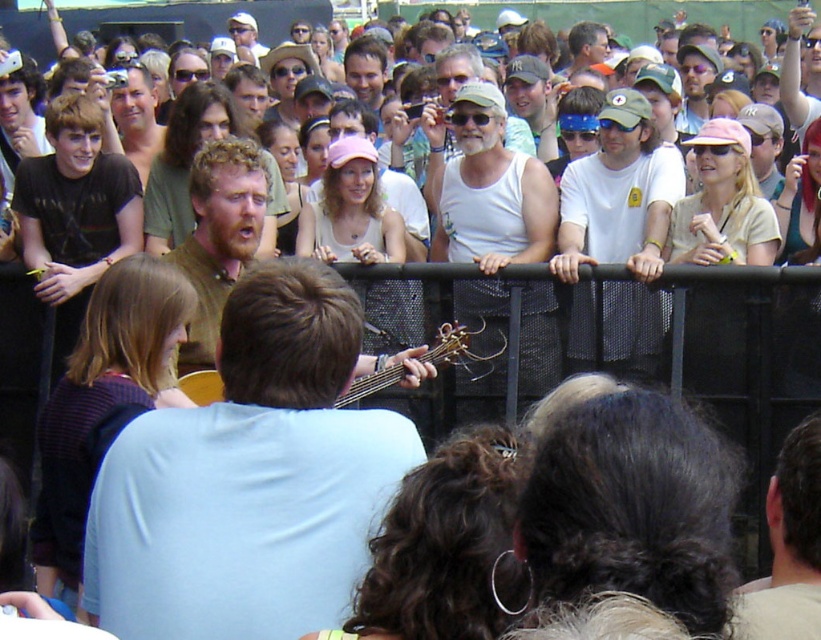
Question: Is white tank top at center wider than brown hair at center?

Choices:
 (A) yes
 (B) no

Answer: (A)

Question: Does white tank top at center appear over matte white tank top at center?

Choices:
 (A) no
 (B) yes

Answer: (A)

Question: Which object appears farthest from the camera in this image?

Choices:
 (A) brown wood guitar at center
 (B) brown hair at center

Answer: (B)

Question: Considering the real-world distances, which object is closest to the matte brown shirt at center?

Choices:
 (A) brown wood guitar at center
 (B) brown hair at center
 (C) pink fabric cap at upper right

Answer: (B)

Question: Which object is farther from the camera taking this photo?

Choices:
 (A) dark brown hair at upper center
 (B) white cotton t-shirt at center
 (C) striped sweater at left

Answer: (B)

Question: Does brown wood guitar at center lie behind matte brown shirt at center?

Choices:
 (A) yes
 (B) no

Answer: (B)